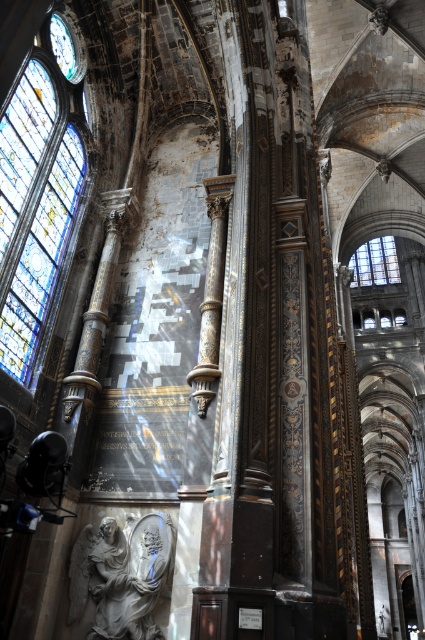
Question: Which point is farther from the camera taking this photo?

Choices:
 (A) [x=362, y=244]
 (B) [x=88, y=637]
 (C) [x=65, y=28]
 (D) [x=57, y=160]

Answer: (A)

Question: Can you confirm if white marble statue at center is smaller than metallic clock face at upper left?

Choices:
 (A) no
 (B) yes

Answer: (A)

Question: Which of the following is the farthest from the observer?

Choices:
 (A) white marble statue at center
 (B) gold polished pillar at center
 (C) stained glass window at left
 (D) metallic clock face at upper left

Answer: (D)

Question: Among these objects, which one is farthest from the camera?

Choices:
 (A) gold polished pillar at center
 (B) stained glass window at upper right
 (C) metallic clock face at upper left

Answer: (B)

Question: Can you confirm if stained glass window at upper right is positioned to the right of metallic clock face at upper left?

Choices:
 (A) no
 (B) yes

Answer: (B)

Question: Observing the image, what is the correct spatial positioning of white marble statue at center in reference to metallic clock face at upper left?

Choices:
 (A) below
 (B) above

Answer: (A)